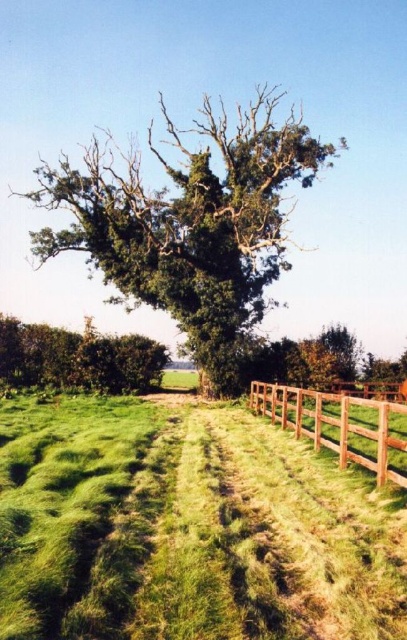
Question: Is green leafy tree at center bigger than green leafy bush at lower left?

Choices:
 (A) yes
 (B) no

Answer: (A)

Question: Which point appears closest to the camera in this image?

Choices:
 (A) (218, 330)
 (B) (321, 413)

Answer: (B)

Question: Which of the following is the farthest from the observer?

Choices:
 (A) brown wooden fence at right
 (B) green leafy tree at center
 (C) green leafy bush at lower left

Answer: (B)

Question: In this image, where is green leafy bush at lower left located relative to brown wooden fence at right?

Choices:
 (A) right
 (B) left

Answer: (B)

Question: Is green leafy tree at center above green leafy bush at lower left?

Choices:
 (A) no
 (B) yes

Answer: (B)

Question: Based on their relative distances, which object is farther from the green leafy bush at lower left?

Choices:
 (A) brown wooden fence at right
 (B) green leafy tree at center

Answer: (A)